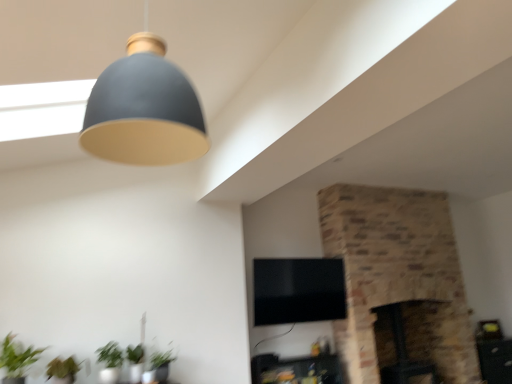
Question: Is dark brown stone fireplace at center-right, the 1th fireplace when ordered from left to right, smaller than matte gray lampshade at upper center?

Choices:
 (A) no
 (B) yes

Answer: (A)

Question: Does dark brown stone fireplace at center-right, acting as the 2th fireplace starting from the right, turn towards matte gray lampshade at upper center?

Choices:
 (A) yes
 (B) no

Answer: (B)

Question: Is dark brown stone fireplace at center-right, the 1th fireplace when ordered from left to right, positioned before matte gray lampshade at upper center?

Choices:
 (A) yes
 (B) no

Answer: (B)

Question: Is dark brown stone fireplace at center-right, acting as the 2th fireplace starting from the right, with matte gray lampshade at upper center?

Choices:
 (A) yes
 (B) no

Answer: (B)

Question: Is matte gray lampshade at upper center located within dark brown stone fireplace at center-right, acting as the 2th fireplace starting from the right?

Choices:
 (A) no
 (B) yes

Answer: (A)

Question: Can you confirm if dark brown stone fireplace at center-right, acting as the 2th fireplace starting from the right, is taller than matte gray lampshade at upper center?

Choices:
 (A) yes
 (B) no

Answer: (A)

Question: Is green matte plant at lower left, arranged as the 2th plant when viewed from the left, positioned before dark brown stone fireplace at center-right, acting as the 2th fireplace starting from the right?

Choices:
 (A) no
 (B) yes

Answer: (B)

Question: Would you say green matte plant at lower left, arranged as the 2th plant when viewed from the left, is outside dark brown stone fireplace at center-right, the 1th fireplace when ordered from left to right?

Choices:
 (A) no
 (B) yes

Answer: (B)

Question: Does green matte plant at lower left, which ranks as the first plant in right-to-left order, have a greater width compared to dark brown stone fireplace at center-right, the 1th fireplace when ordered from left to right?

Choices:
 (A) yes
 (B) no

Answer: (B)

Question: Is green matte plant at lower left, arranged as the 2th plant when viewed from the left, next to dark brown stone fireplace at center-right, the 1th fireplace when ordered from left to right, and touching it?

Choices:
 (A) yes
 (B) no

Answer: (B)

Question: Is green matte plant at lower left, which ranks as the first plant in right-to-left order, positioned with its back to dark brown stone fireplace at center-right, the 1th fireplace when ordered from left to right?

Choices:
 (A) no
 (B) yes

Answer: (A)

Question: Considering the relative positions of green matte plant at lower left, which ranks as the first plant in right-to-left order, and dark brown stone fireplace at center-right, acting as the 2th fireplace starting from the right, in the image provided, is green matte plant at lower left, which ranks as the first plant in right-to-left order, to the left of dark brown stone fireplace at center-right, acting as the 2th fireplace starting from the right, from the viewer's perspective?

Choices:
 (A) yes
 (B) no

Answer: (A)

Question: Is wooden side table at lower right, placed as the 2th furniture when sorted from left to right, not inside dark brown stone fireplace at center-right, the 1th fireplace when ordered from left to right?

Choices:
 (A) no
 (B) yes

Answer: (B)